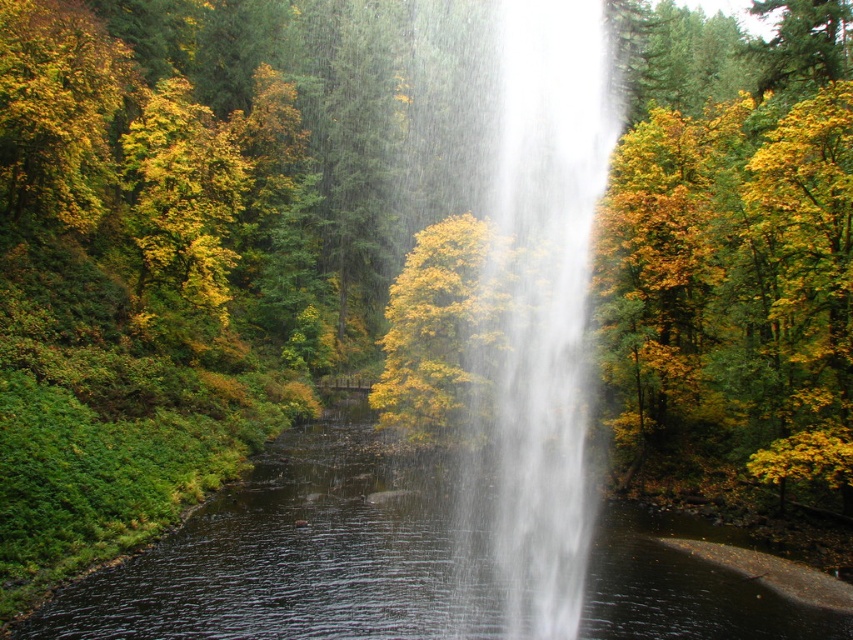
The height and width of the screenshot is (640, 853). What do you see at coordinates (525, 296) in the screenshot?
I see `white misty waterfall at center` at bounding box center [525, 296].

Which is more to the left, white misty waterfall at center or transparent water at center?

transparent water at center

Who is more distant from viewer, (569, 282) or (300, 516)?

The point (569, 282) is more distant.

This screenshot has width=853, height=640. In order to click on white misty waterfall at center in this screenshot , I will do `click(525, 296)`.